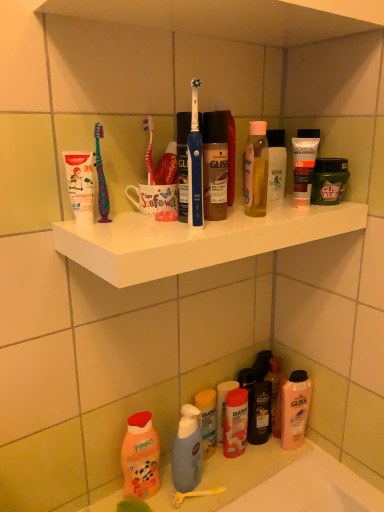
The height and width of the screenshot is (512, 384). Find the location of `vacant space in front of translucent plastic bottle at lower center, which appears as the 4th toiletry when viewed from the top`. vacant space in front of translucent plastic bottle at lower center, which appears as the 4th toiletry when viewed from the top is located at coordinates coord(228,474).